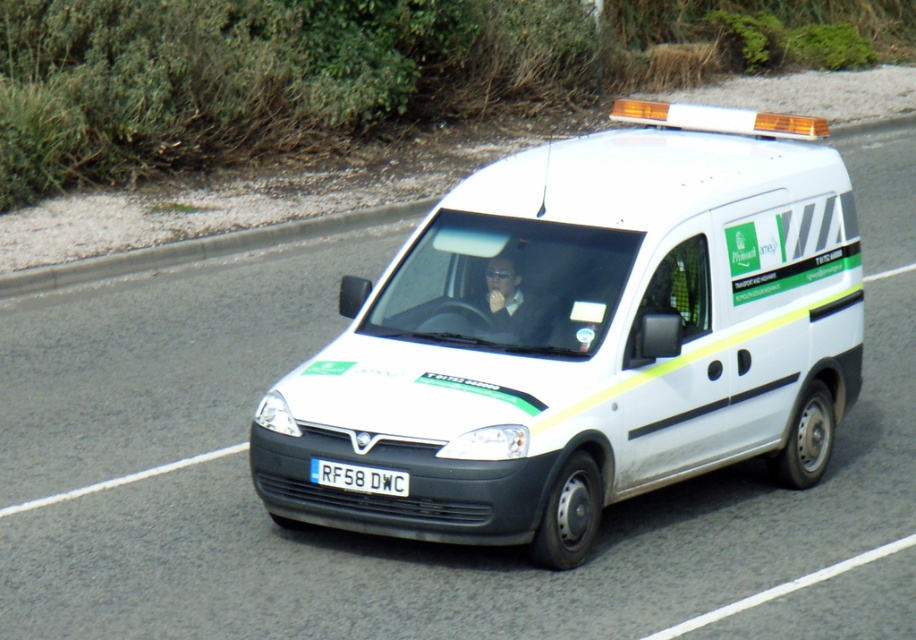
You are a driver who needs to park your white matte van at center in a garage that has a height restriction of 1.8 meters. The white plastic license plate at center is currently 1.5 meters above the ground. Can your van fit under the height restriction without any modifications?

The white matte van at center is taller than the white plastic license plate at center, which is 1.5 meters above the ground. Since the van is taller than the license plate, its height exceeds 1.5 meters. However, the exact height of the van isn t specified. If the van s total height is under 1.8 meters, it can fit. Without knowing the van s exact height, we can t confirm for sure.

You are a pedestrian standing on the sidewalk. You see the white matte van at center and the white plastic license plate at center. Which object is nearer to you?

The white matte van at center is closer to the viewer than the white plastic license plate at center, so the white matte van at center is nearer to you.